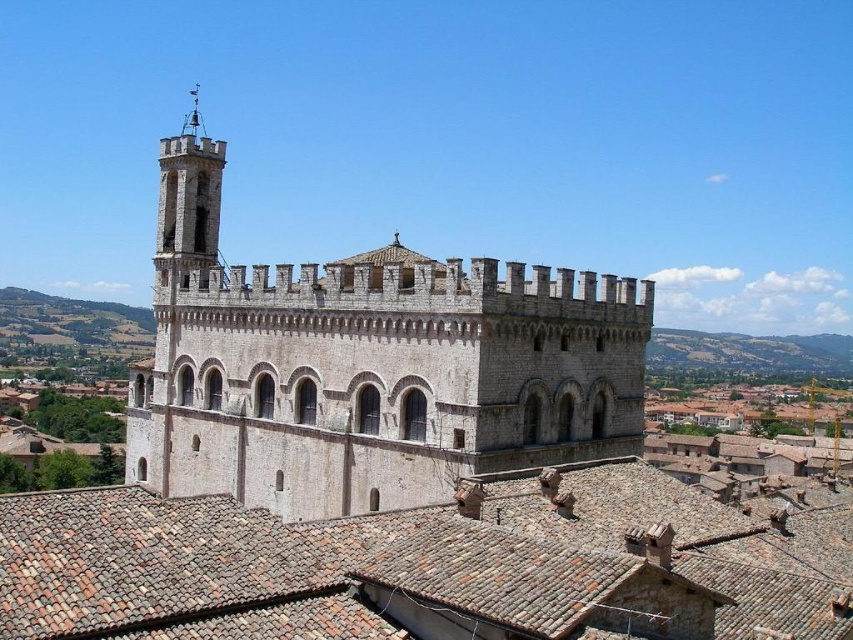
Can you confirm if white stone church at center is shorter than brown tile roof at center?

In fact, white stone church at center may be taller than brown tile roof at center.

Can you confirm if white stone church at center is bigger than brown tile roof at center?

Correct, white stone church at center is larger in size than brown tile roof at center.

Who is more distant from viewer, (405, 458) or (161, 621)?

The point (405, 458) is behind.

This screenshot has width=853, height=640. Identify the location of white stone church at center. (367, 365).